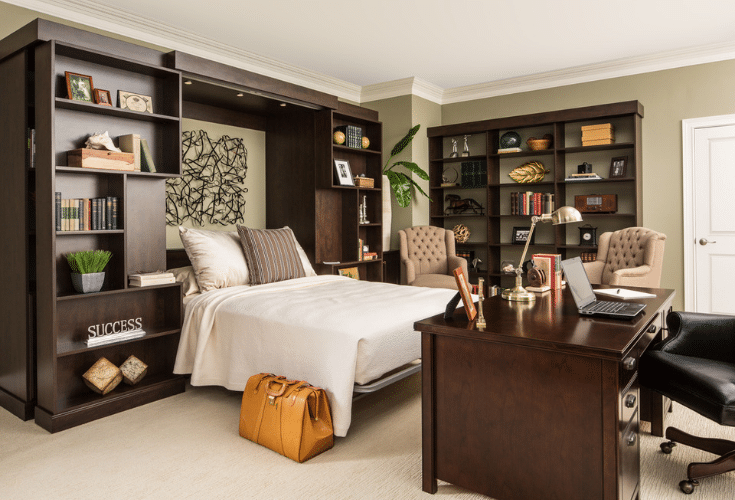
Identify the location of dark wooden desk. The height and width of the screenshot is (500, 735). (564, 388).